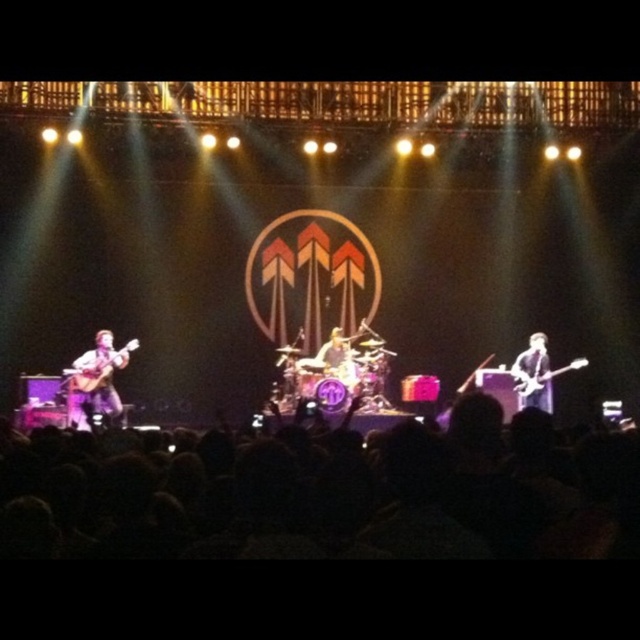
This screenshot has height=640, width=640. In order to click on black fabric crowd at lower center in this screenshot , I will do `click(323, 496)`.

Who is more forward, [554,536] or [330,358]?

Point [554,536] is more forward.

What do you see at coordinates (323, 496) in the screenshot?
I see `black fabric crowd at lower center` at bounding box center [323, 496].

Identify the location of black fabric crowd at lower center. The image size is (640, 640). (323, 496).

Is matte brown guitar at left shorter than glossy black guitar at right?

No.

Does matte brown guitar at left have a lesser width compared to glossy black guitar at right?

In fact, matte brown guitar at left might be wider than glossy black guitar at right.

Locate an element on the screen. matte brown guitar at left is located at coordinates (97, 381).

Can you confirm if shiny silver guitar at center is shorter than glossy electric guitar at right?

No, shiny silver guitar at center is not shorter than glossy electric guitar at right.

Is the position of shiny silver guitar at center more distant than that of glossy electric guitar at right?

Yes, it is behind glossy electric guitar at right.

Identify the location of shiny silver guitar at center. (332, 352).